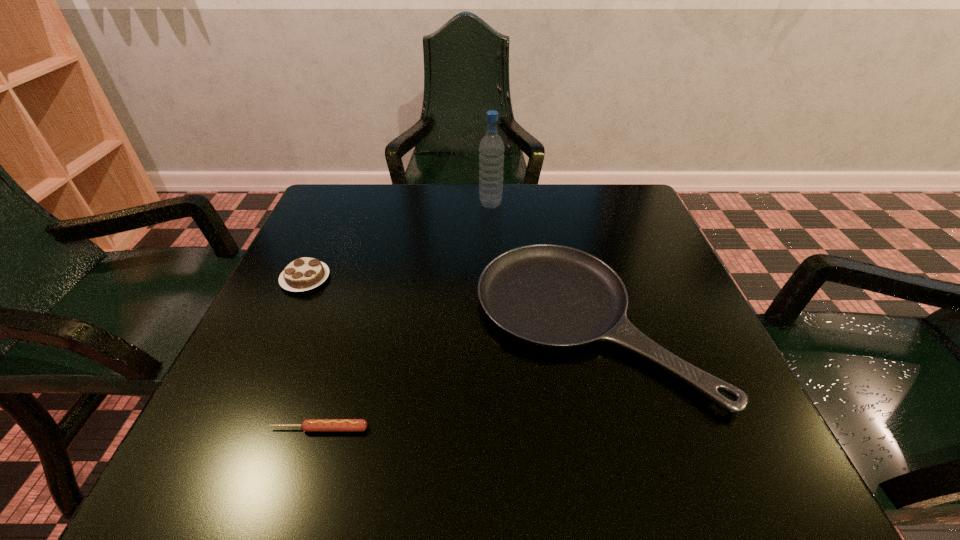
Locate an element on the screen. The height and width of the screenshot is (540, 960). object located in the far edge section of the desktop is located at coordinates (491, 148).

The width and height of the screenshot is (960, 540). Identify the location of object positioned at the near edge. [x=309, y=425].

What are the coordinates of `chocolate cake that is at the left edge` in the screenshot? It's located at (303, 274).

At what (x,y) coordinates should I click in order to perform the action: click on sausage located in the left edge section of the desktop. Please return your answer as a coordinate pair (x, y). The height and width of the screenshot is (540, 960). Looking at the image, I should click on (309, 425).

The image size is (960, 540). I want to click on object positioned at the right edge, so click(549, 295).

The height and width of the screenshot is (540, 960). Find the location of `object located at the near left corner`. object located at the near left corner is located at coordinates (309, 425).

In order to click on vacant space at the far edge of the desktop in this screenshot , I will do `click(388, 223)`.

In the image, there is a desktop. Identify the location of vacant space at the near edge. This screenshot has height=540, width=960. (518, 458).

In the image, there is a desktop. At what (x,y) coordinates should I click in order to perform the action: click on free space at the left edge. Please return your answer as a coordinate pair (x, y). Looking at the image, I should click on (305, 388).

Where is `vacant position at the right edge of the desktop`? Image resolution: width=960 pixels, height=540 pixels. vacant position at the right edge of the desktop is located at coordinates (633, 272).